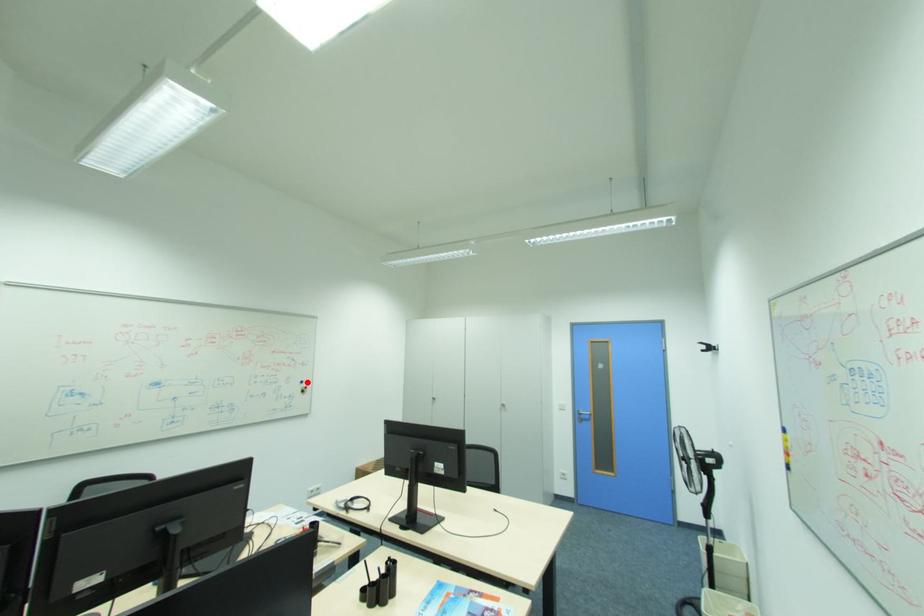
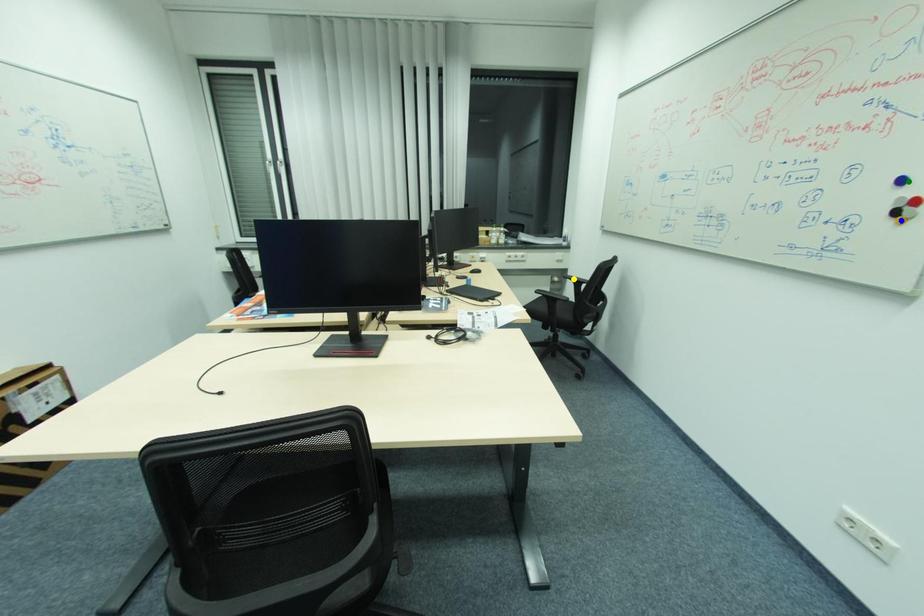
Question: I am providing you with two images of the same scene from different viewpoints. A red point is marked on the first image. You are given multiple points on the second image. Which point in image 2 represents the same 3d spot as the red point in image 1?

Choices:
 (A) blue point
 (B) green point
 (C) yellow point

Answer: (B)